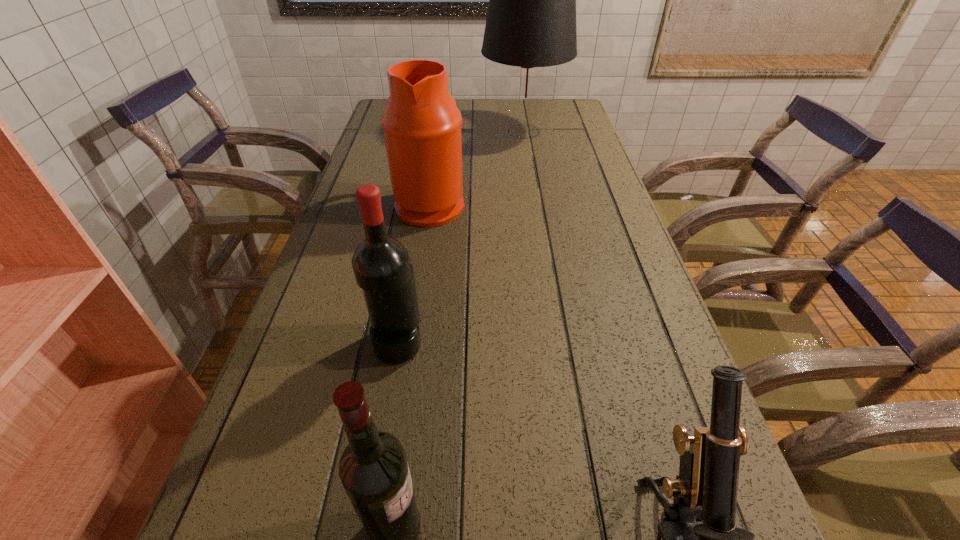
At what (x,y) coordinates should I click in order to perform the action: click on object located in the far right corner section of the desktop. Please return your answer as a coordinate pair (x, y). Looking at the image, I should click on (531, 21).

The image size is (960, 540). In the image, there is a desktop. Find the location of `vacant region at the left edge`. vacant region at the left edge is located at coordinates (317, 417).

Find the location of a particular element. The image size is (960, 540). vacant area at the right edge is located at coordinates (574, 156).

This screenshot has height=540, width=960. What are the coordinates of `free space at the far right corner` in the screenshot? It's located at (567, 100).

You are a GUI agent. You are given a task and a screenshot of the screen. Output one action in this format:
    pyautogui.click(x=<x>, y=<y>)
    Task: Click on the vacant area between the farthest object and the farther wine bottle
    The width and height of the screenshot is (960, 540).
    Given the screenshot: What is the action you would take?
    461,237

The width and height of the screenshot is (960, 540). Find the location of `vacant region between the water jug and the tallest object`. vacant region between the water jug and the tallest object is located at coordinates (477, 167).

Identify which object is the second closest to the water jug. Please provide its 2D coordinates. Your answer should be formatted as a tuple, i.e. [(x, y)], where the tuple contains the x and y coordinates of a point satisfying the conditions above.

[(381, 264)]

Locate an element on the screen. This screenshot has height=540, width=960. the third closest object to the nearer wine bottle is located at coordinates (421, 123).

I want to click on free location that satisfies the following two spatial constraints: 1. from the spout of the second farthest object; 2. on the front side of the third farthest object, so click(410, 342).